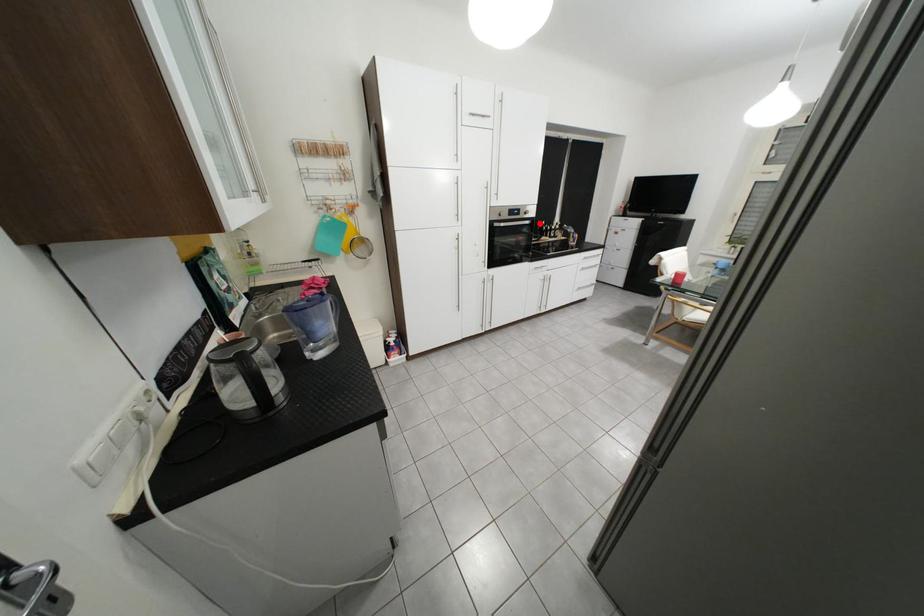
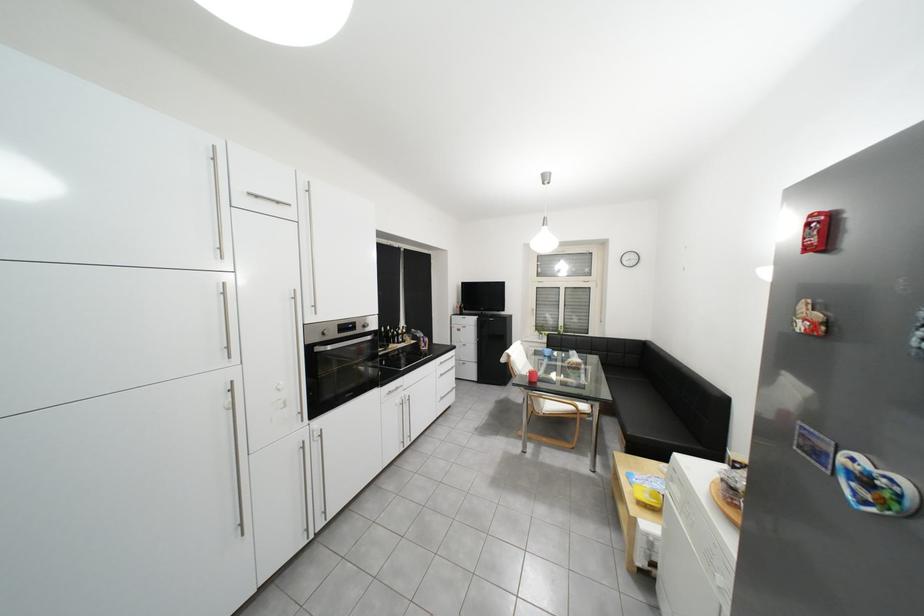
Find the pixel in the second image that matches the highlighted location in the first image.

(381, 339)